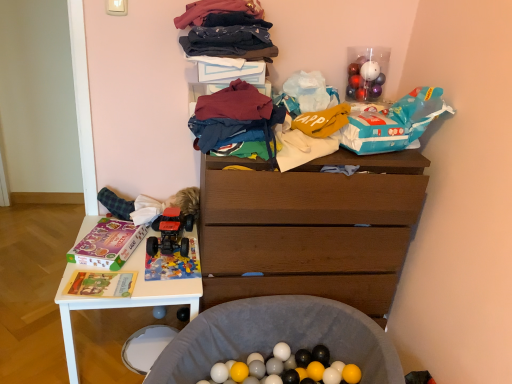
Question: Is point (232, 36) closer or farther from the camera than point (195, 216)?

Choices:
 (A) closer
 (B) farther

Answer: (A)

Question: From the image's perspective, is soft cotton clothes at upper center positioned above or below fluffy green fabric at left?

Choices:
 (A) below
 (B) above

Answer: (B)

Question: Which is nearer to the rubberized red truck at lower left?

Choices:
 (A) white plastic desk at lower left
 (B) soft cotton clothes at upper center
 (C) wooden chest of drawers at center
 (D) dark blue cotton socks at upper center, marked as the second clothing in a bottom-to-top arrangement
 (E) soft gray fabric ball pit at lower center, which is counted as the 1th waste, starting from the bottom

Answer: (A)

Question: Which of these objects is positioned farthest from the wooden chest of drawers at center?

Choices:
 (A) soft cotton clothes at upper center
 (B) matte yellow book at lower left, positioned as the second magazine in top-to-bottom order
 (C) dark blue cotton socks at upper center, positioned as the first clothing in top-to-bottom order
 (D) blue plastic bag at upper right, the first waste viewed from the top
 (E) soft gray fabric ball pit at lower center, the 2th waste positioned from the top

Answer: (B)